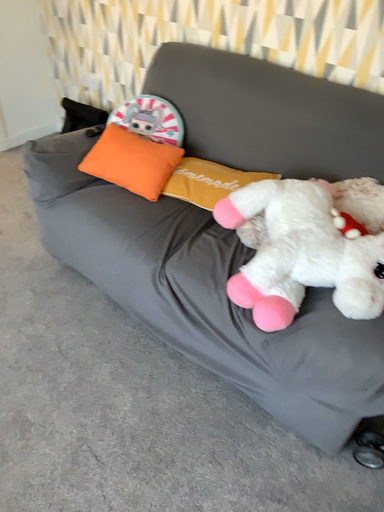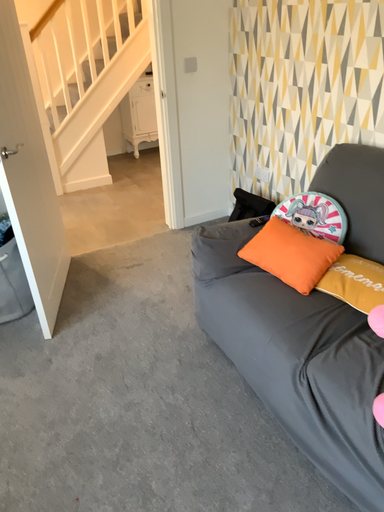
Question: Which way did the camera rotate in the video?

Choices:
 (A) rotated upward
 (B) rotated downward

Answer: (A)